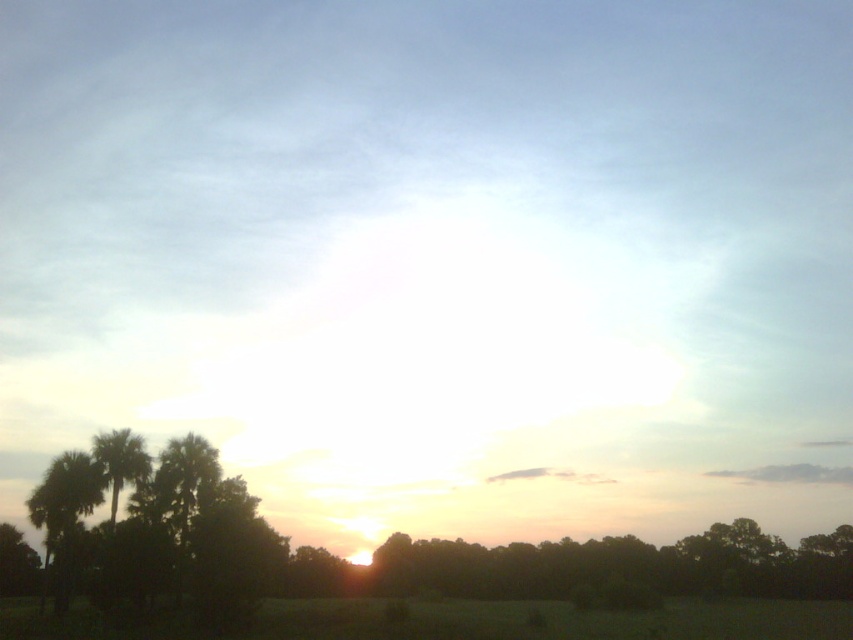
From the picture: You are standing in the middle of the green grassy field at lower center and want to walk towards the silhouette palm trees at lower left. Which direction should you head?

The silhouette palm trees at lower left are positioned on the left side of the green grassy field at lower center, so you should head towards the left direction to reach them.

You are standing in the sunset scene and want to walk towards the green grassy field at lower center. Which direction should you walk to avoid the silhouette palm trees at lower left?

The silhouette palm trees at lower left are above the green grassy field at lower center, so you should walk towards the lower part of the scene to reach the green grassy field at lower center without going near the silhouette palm trees at lower left.